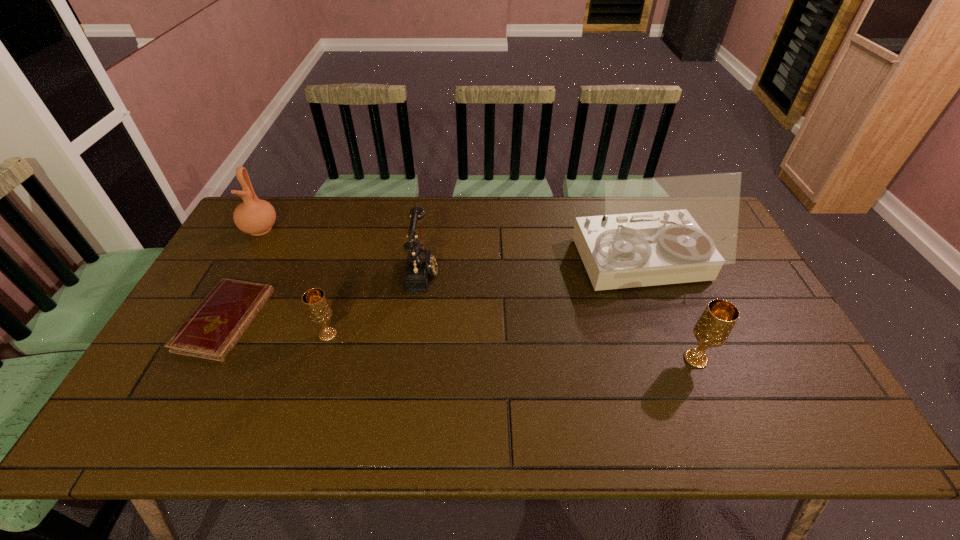
You are a GUI agent. You are given a task and a screenshot of the screen. Output one action in this format:
    pyautogui.click(x=<x>, y=<y>)
    Task: Click on the vacant space that satisfies the following two spatial constraints: 1. on the dial of the fourth object from left to right; 2. on the front side of the second shortest object
    The image size is (960, 540).
    Given the screenshot: What is the action you would take?
    pyautogui.click(x=415, y=335)